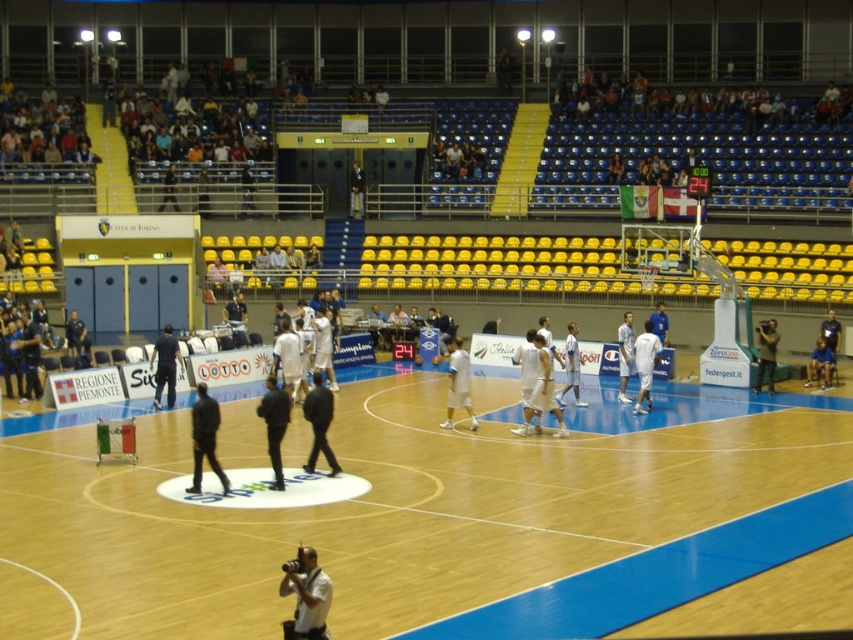
Which is below, wooden at center or white matte camera at lower center?

wooden at center is lower down.

Is wooden at center smaller than white matte camera at lower center?

No, wooden at center is not smaller than white matte camera at lower center.

Between point (846, 428) and point (283, 588), which one is positioned in front?

Positioned in front is point (283, 588).

Where is `wooden at center`? The image size is (853, 640). wooden at center is located at coordinates (425, 518).

Which is more to the right, wooden at center or dark gray jacket at center?

dark gray jacket at center is more to the right.

Does point (699, 433) come farther from viewer compared to point (758, 388)?

No.

Between point (439, 429) and point (769, 323), which one is positioned in front?

Point (439, 429) is in front.

You are a GUI agent. You are given a task and a screenshot of the screen. Output one action in this format:
    pyautogui.click(x=<x>, y=<y>)
    Task: Click on the wooden at center
    This screenshot has height=640, width=853.
    Given the screenshot: What is the action you would take?
    pyautogui.click(x=425, y=518)

Between dark blue jacket at center and dark gray jacket at center, which one is positioned higher?

dark gray jacket at center is higher up.

Does dark blue jacket at center have a greater width compared to dark gray jacket at center?

Yes.

Find the location of a particular element. This screenshot has height=640, width=853. dark blue jacket at center is located at coordinates (206, 438).